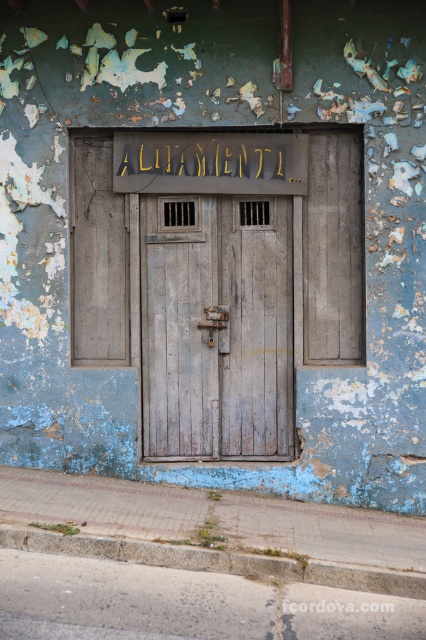
Does weathered wood door at center appear on the left side of gold metallic sign at upper center?

Incorrect, weathered wood door at center is not on the left side of gold metallic sign at upper center.

In the scene shown: Is weathered wood door at center to the right of gold metallic sign at upper center from the viewer's perspective?

Indeed, weathered wood door at center is positioned on the right side of gold metallic sign at upper center.

Is point (218, 385) closer to camera compared to point (161, 141)?

That is False.

This screenshot has width=426, height=640. What are the coordinates of `weathered wood door at center` in the screenshot? It's located at (216, 326).